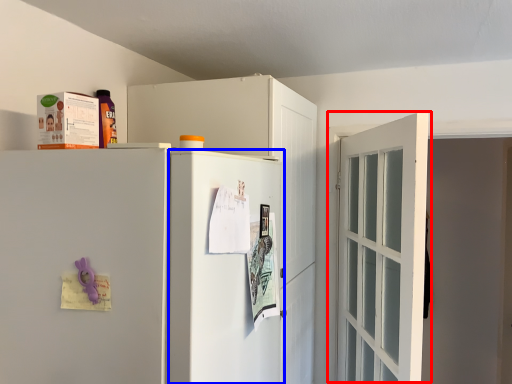
Question: Which of the following is the farthest to the observer, door (highlighted by a red box) or screen door (highlighted by a blue box)?

Choices:
 (A) door
 (B) screen door

Answer: (A)